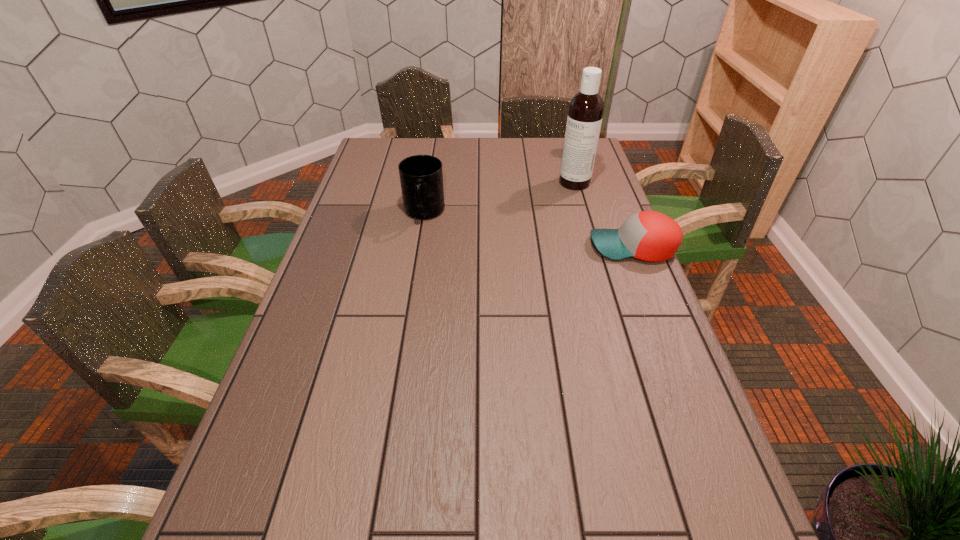
Identify the location of vacant space that's between the baseball cap and the farthest object. The image size is (960, 540). click(604, 215).

Where is `free spot between the mug and the farthest object`? free spot between the mug and the farthest object is located at coordinates (499, 198).

Find the location of a particular element. The image size is (960, 540). free space between the dishwasher detergent and the second nearest object is located at coordinates (499, 198).

Where is `object that is the second closest to the dishwasher detergent`? The height and width of the screenshot is (540, 960). object that is the second closest to the dishwasher detergent is located at coordinates (421, 177).

This screenshot has width=960, height=540. In order to click on object identified as the closest to the tallest object in this screenshot , I will do `click(651, 236)`.

Locate an element on the screen. The image size is (960, 540). vacant space that satisfies the following two spatial constraints: 1. on the side of the nearest object with the handle; 2. at the brim of the second farthest object is located at coordinates (419, 247).

You are a GUI agent. You are given a task and a screenshot of the screen. Output one action in this format:
    pyautogui.click(x=<x>, y=<y>)
    Task: Click on the free spot that satisfies the following two spatial constraints: 1. on the side of the leftmost object with the handle; 2. at the brim of the baseball cap
    This screenshot has height=540, width=960.
    Given the screenshot: What is the action you would take?
    pyautogui.click(x=419, y=247)

Image resolution: width=960 pixels, height=540 pixels. I want to click on blank space that satisfies the following two spatial constraints: 1. on the side of the nearest object with the handle; 2. at the brim of the leftmost object, so click(x=419, y=247).

Where is `free space that satisfies the following two spatial constraints: 1. on the side of the nearest object with the handle; 2. at the brim of the mug`? This screenshot has height=540, width=960. free space that satisfies the following two spatial constraints: 1. on the side of the nearest object with the handle; 2. at the brim of the mug is located at coordinates 419,247.

Identify the location of vacant area that satisfies the following two spatial constraints: 1. on the side of the leftmost object with the handle; 2. at the brim of the baseball cap. (419, 247).